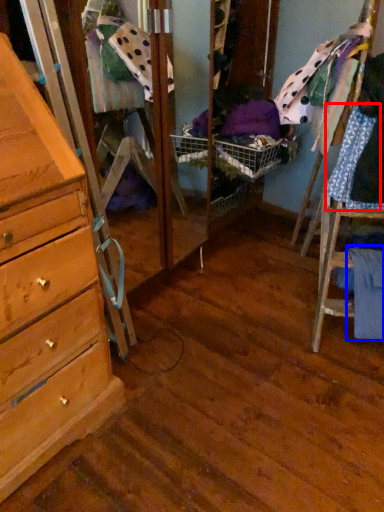
Question: Which point is further to the camera, clothing (highlighted by a red box) or clothing (highlighted by a blue box)?

Choices:
 (A) clothing
 (B) clothing

Answer: (B)